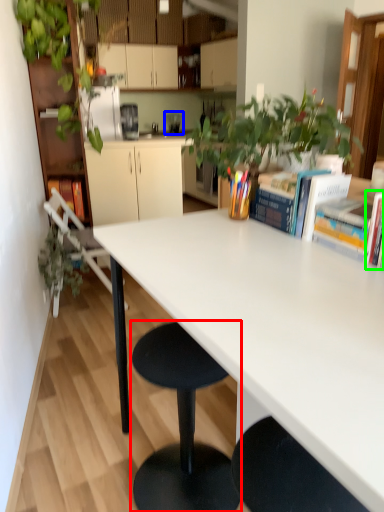
Question: Which is nearer to the stool (highlighted by a red box)? appliance (highlighted by a blue box) or book (highlighted by a green box).

Choices:
 (A) appliance
 (B) book

Answer: (B)